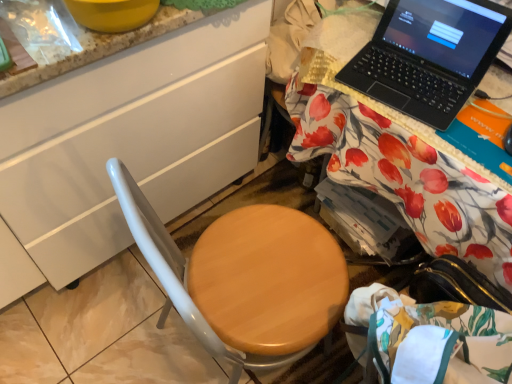
Question: Considering the relative sizes of wooden at right and black plastic laptop at upper right in the image provided, is wooden at right bigger than black plastic laptop at upper right?

Choices:
 (A) no
 (B) yes

Answer: (B)

Question: Is wooden at right thinner than black plastic laptop at upper right?

Choices:
 (A) yes
 (B) no

Answer: (B)

Question: Does wooden at right lie behind black plastic laptop at upper right?

Choices:
 (A) no
 (B) yes

Answer: (A)

Question: Does wooden at right appear on the right side of black plastic laptop at upper right?

Choices:
 (A) yes
 (B) no

Answer: (A)

Question: Can you confirm if wooden at right is smaller than black plastic laptop at upper right?

Choices:
 (A) yes
 (B) no

Answer: (B)

Question: Visually, is white glossy cabinet at left positioned to the left or to the right of black plastic laptop at upper right?

Choices:
 (A) left
 (B) right

Answer: (A)

Question: Considering their positions, is white glossy cabinet at left located in front of or behind black plastic laptop at upper right?

Choices:
 (A) front
 (B) behind

Answer: (A)

Question: From a real-world perspective, is white glossy cabinet at left above or below black plastic laptop at upper right?

Choices:
 (A) below
 (B) above

Answer: (A)

Question: Does point (53, 268) appear closer or farther from the camera than point (398, 61)?

Choices:
 (A) farther
 (B) closer

Answer: (A)

Question: From the image's perspective, is white glossy cabinet at left positioned above or below wooden at right?

Choices:
 (A) below
 (B) above

Answer: (B)

Question: Is white glossy cabinet at left inside or outside of wooden at right?

Choices:
 (A) inside
 (B) outside

Answer: (B)

Question: Is point (82, 71) closer or farther from the camera than point (317, 152)?

Choices:
 (A) farther
 (B) closer

Answer: (B)

Question: From their relative heights in the image, would you say white glossy cabinet at left is taller or shorter than wooden at right?

Choices:
 (A) tall
 (B) short

Answer: (A)

Question: From the image's perspective, is black plastic laptop at upper right above or below wooden at right?

Choices:
 (A) above
 (B) below

Answer: (A)

Question: Considering their positions, is black plastic laptop at upper right located in front of or behind wooden at right?

Choices:
 (A) behind
 (B) front

Answer: (A)